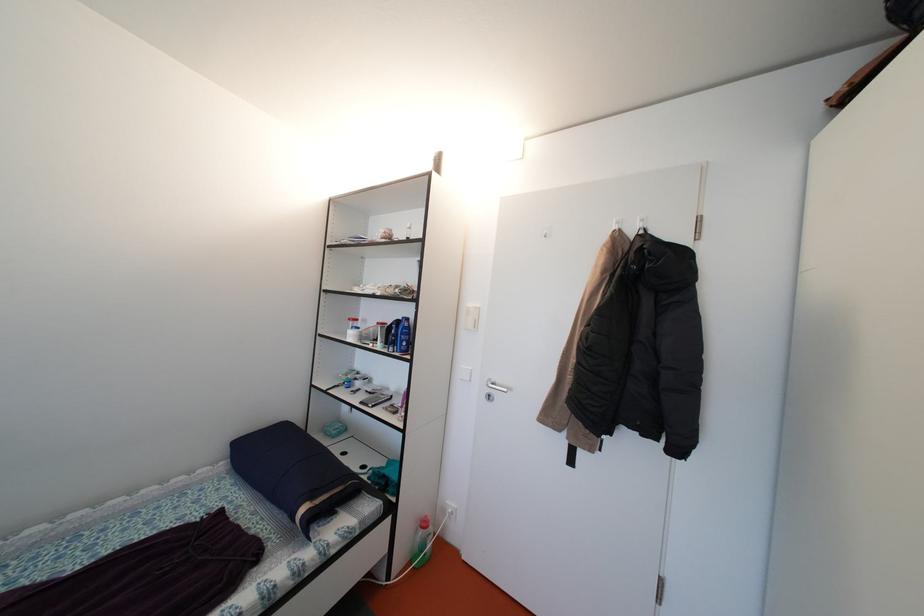
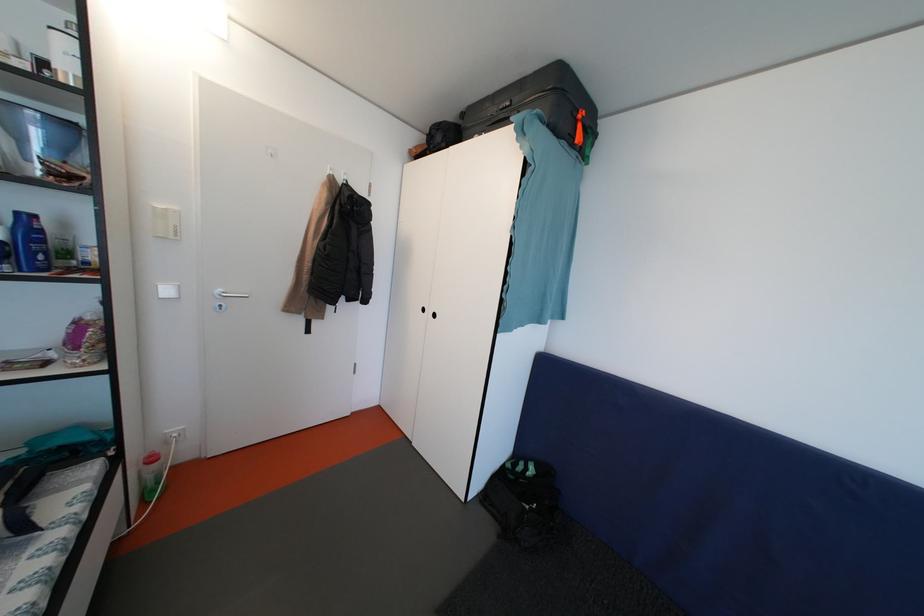
The images are taken continuously from a first-person perspective. In which direction is your viewpoint rotating?

The rotation direction of the camera is right-down.